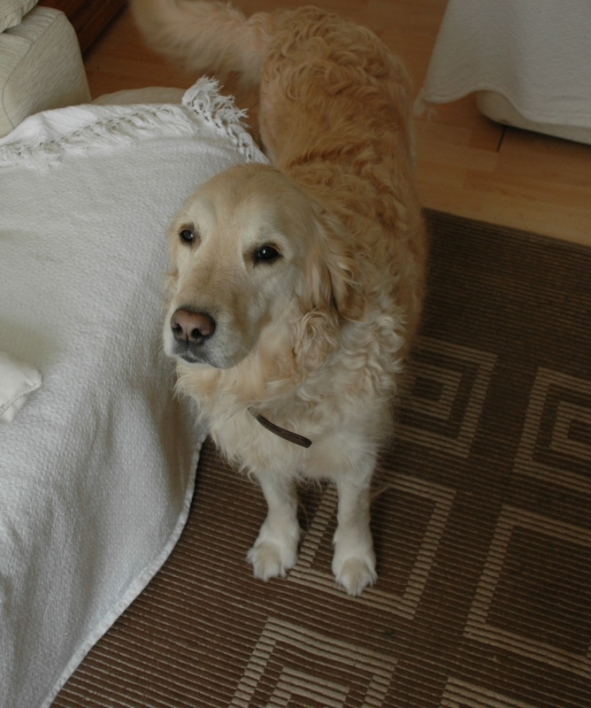
Find the location of a particular element. The height and width of the screenshot is (708, 591). table is located at coordinates (477, 180).